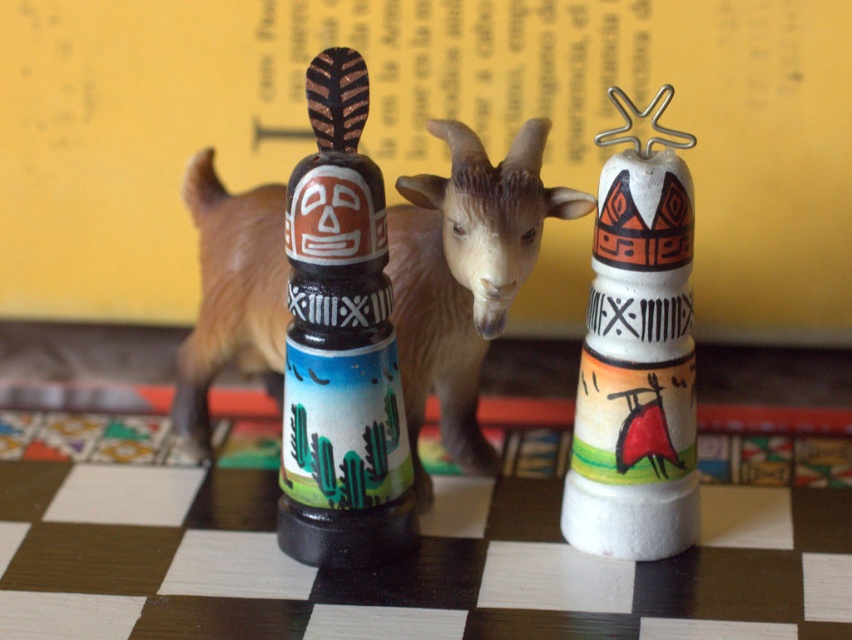
You are an interior designer arranging items on a shelf. You have a brown plastic goat at center and a white matte totem at right. According to the scene, which object is positioned higher up?

The brown plastic goat at center is positioned higher up than the white matte totem at right.

You are an art curator arranging a display. You have a brown plastic goat at center and a matte painted totem pole at center. Which object is positioned higher in the scene?

The brown plastic goat at center is positioned higher than the matte painted totem pole at center.

You are a delivery robot with a 10 inch wide package. You need to move the package from the matte painted totem pole at center to the white matte totem at right. Can you fit the package between them without tilting it?

The distance between the matte painted totem pole at center and the white matte totem at right is 9.58 inches. Since the package is 10 inches wide, it cannot fit through the space between them without tilting.